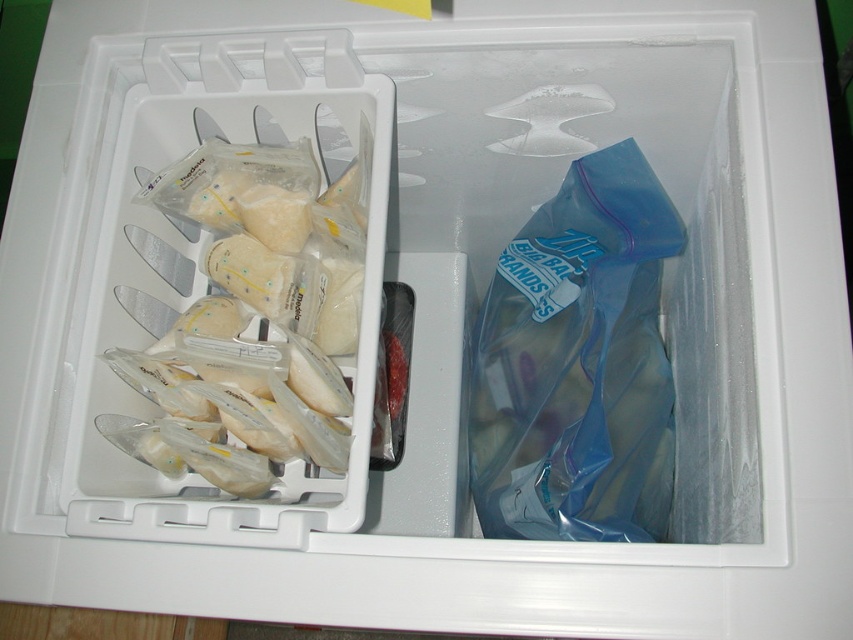
Between transparent plastic bag at right and translucent plastic bags at left, which one appears on the left side from the viewer's perspective?

From the viewer's perspective, translucent plastic bags at left appears more on the left side.

Is transparent plastic bag at right to the left of translucent plastic bags at left from the viewer's perspective?

Incorrect, transparent plastic bag at right is not on the left side of translucent plastic bags at left.

Which is in front, point (625, 220) or point (253, 182)?

Point (253, 182) is in front.

Locate an element on the screen. The image size is (853, 640). transparent plastic bag at right is located at coordinates (578, 364).